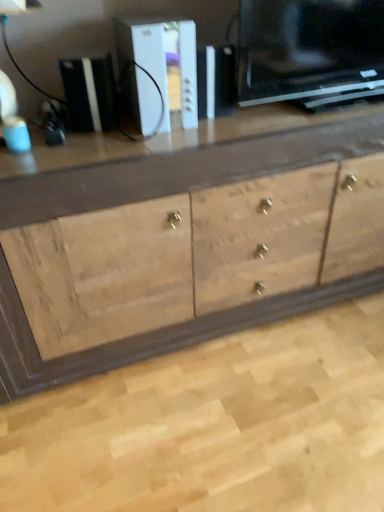
Question: Is natural wood cabinet at center at the right side of white plastic gaming console at upper center, the second appliance when ordered from right to left?

Choices:
 (A) no
 (B) yes

Answer: (B)

Question: From a real-world perspective, is natural wood cabinet at center under white plastic gaming console at upper center, the second appliance when ordered from right to left?

Choices:
 (A) no
 (B) yes

Answer: (B)

Question: Does natural wood cabinet at center have a lesser width compared to white plastic gaming console at upper center, the 1th appliance when ordered from left to right?

Choices:
 (A) no
 (B) yes

Answer: (A)

Question: From the image's perspective, does natural wood cabinet at center appear lower than white plastic gaming console at upper center, the second appliance when ordered from right to left?

Choices:
 (A) no
 (B) yes

Answer: (B)

Question: Is natural wood cabinet at center touching white plastic gaming console at upper center, the second appliance when ordered from right to left?

Choices:
 (A) no
 (B) yes

Answer: (A)

Question: Looking at their shapes, would you say white plastic console at center, which is counted as the 1th appliance, starting from the right, is wider or thinner than natural wood cabinet at center?

Choices:
 (A) wide
 (B) thin

Answer: (B)

Question: Is white plastic console at center, arranged as the second appliance when viewed from the left, to the left or to the right of natural wood cabinet at center in the image?

Choices:
 (A) right
 (B) left

Answer: (B)

Question: Relative to natural wood cabinet at center, is white plastic console at center, arranged as the second appliance when viewed from the left, in front or behind?

Choices:
 (A) front
 (B) behind

Answer: (B)

Question: In terms of size, does white plastic console at center, arranged as the second appliance when viewed from the left, appear bigger or smaller than natural wood cabinet at center?

Choices:
 (A) small
 (B) big

Answer: (A)

Question: Relative to white plastic console at center, which is counted as the 1th appliance, starting from the right, is white plastic gaming console at upper center, the 1th appliance when ordered from left to right, in front or behind?

Choices:
 (A) behind
 (B) front

Answer: (A)

Question: Is white plastic gaming console at upper center, the second appliance when ordered from right to left, wider or thinner than white plastic console at center, arranged as the second appliance when viewed from the left?

Choices:
 (A) thin
 (B) wide

Answer: (A)

Question: Is white plastic gaming console at upper center, the 1th appliance when ordered from left to right, spatially inside white plastic console at center, which is counted as the 1th appliance, starting from the right, or outside of it?

Choices:
 (A) inside
 (B) outside

Answer: (B)

Question: Considering the relative positions of white plastic gaming console at upper center, the 1th appliance when ordered from left to right, and white plastic console at center, arranged as the second appliance when viewed from the left, in the image provided, is white plastic gaming console at upper center, the 1th appliance when ordered from left to right, to the left or to the right of white plastic console at center, arranged as the second appliance when viewed from the left,?

Choices:
 (A) right
 (B) left

Answer: (B)

Question: In terms of size, does white plastic gaming console at upper center, the second appliance when ordered from right to left, appear bigger or smaller than natural wood cabinet at center?

Choices:
 (A) big
 (B) small

Answer: (B)

Question: Is white plastic gaming console at upper center, the 1th appliance when ordered from left to right, wider or thinner than natural wood cabinet at center?

Choices:
 (A) thin
 (B) wide

Answer: (A)